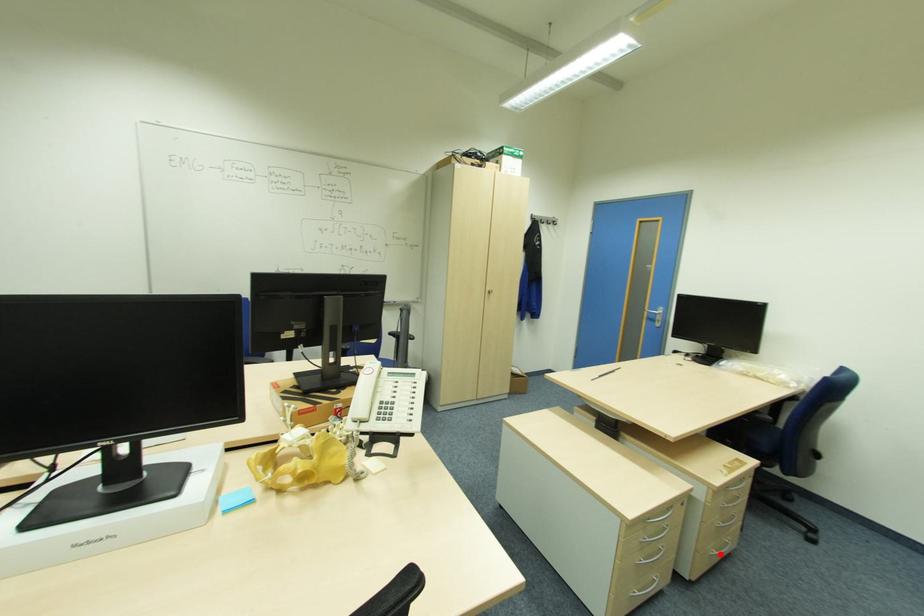
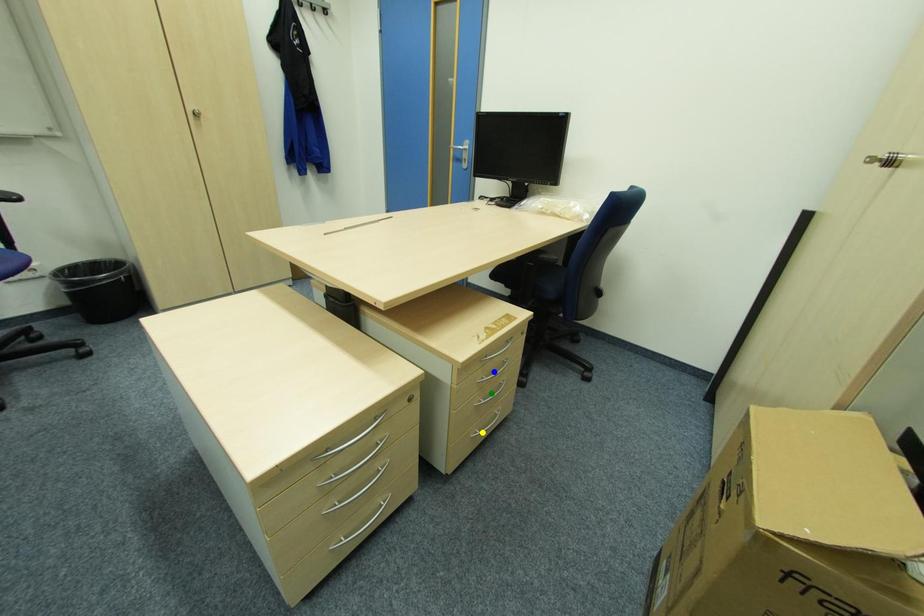
Question: I am providing you with two images of the same scene from different viewpoints. A red point is marked on the first image. You are given multiple points on the second image. Which point in image 2 is actually the same real-world point as the red point in image 1?

Choices:
 (A) green point
 (B) blue point
 (C) yellow point

Answer: (C)